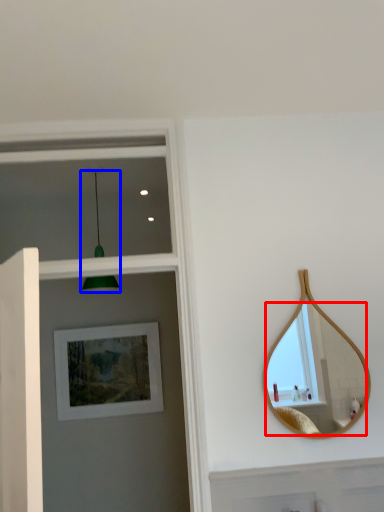
Question: Among these objects, which one is farthest to the camera, mirror (highlighted by a red box) or light fixture (highlighted by a blue box)?

Choices:
 (A) mirror
 (B) light fixture

Answer: (B)